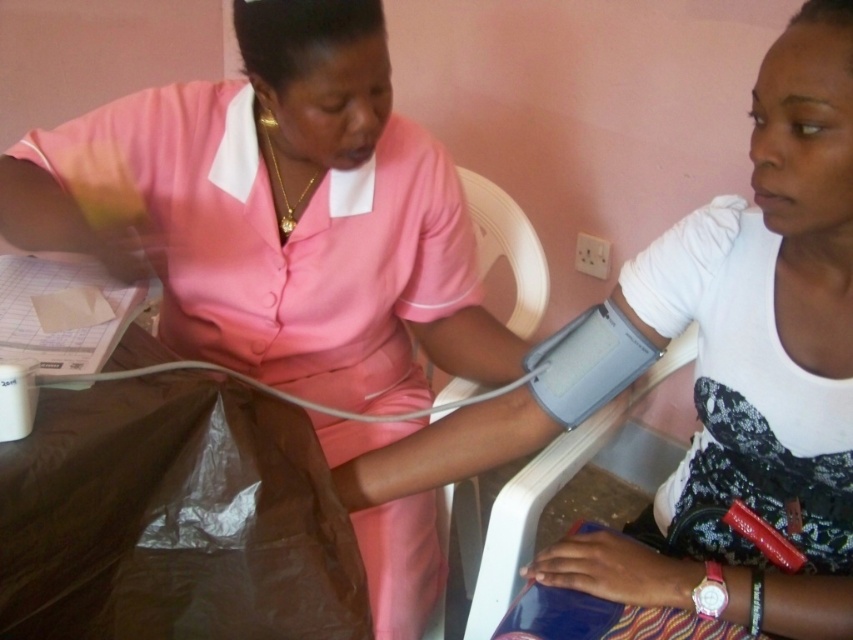
Is the position of pink fabric nurse at center more distant than that of matte pink uniform at center?

Yes, pink fabric nurse at center is behind matte pink uniform at center.

Can you confirm if pink fabric nurse at center is wider than matte pink uniform at center?

Correct, the width of pink fabric nurse at center exceeds that of matte pink uniform at center.

Describe the element at coordinates (277, 212) in the screenshot. I see `pink fabric nurse at center` at that location.

Where is `pink fabric nurse at center`? Image resolution: width=853 pixels, height=640 pixels. pink fabric nurse at center is located at coordinates (277, 212).